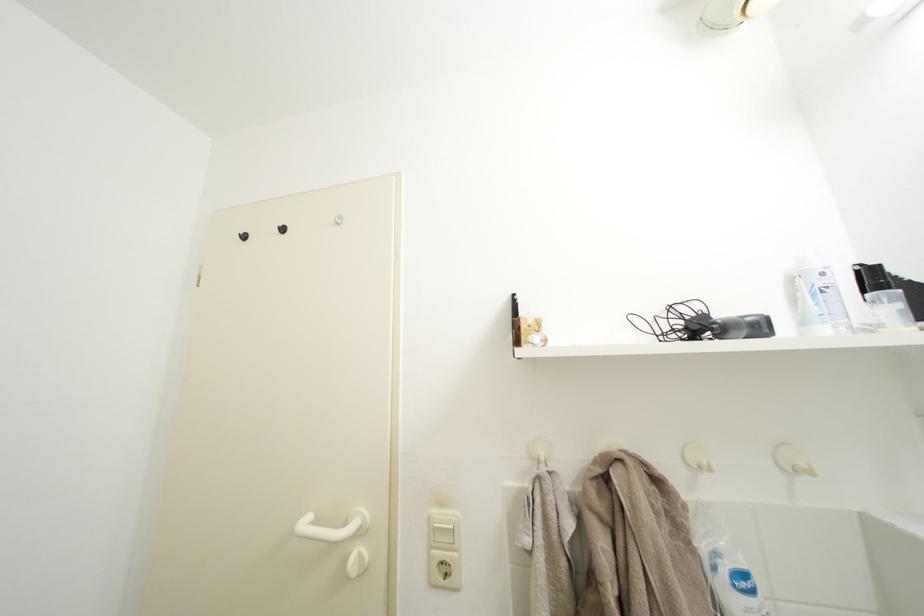
Find where to insert the power outlet. Please return your answer as a coordinate pair (x, y).

(444, 570)